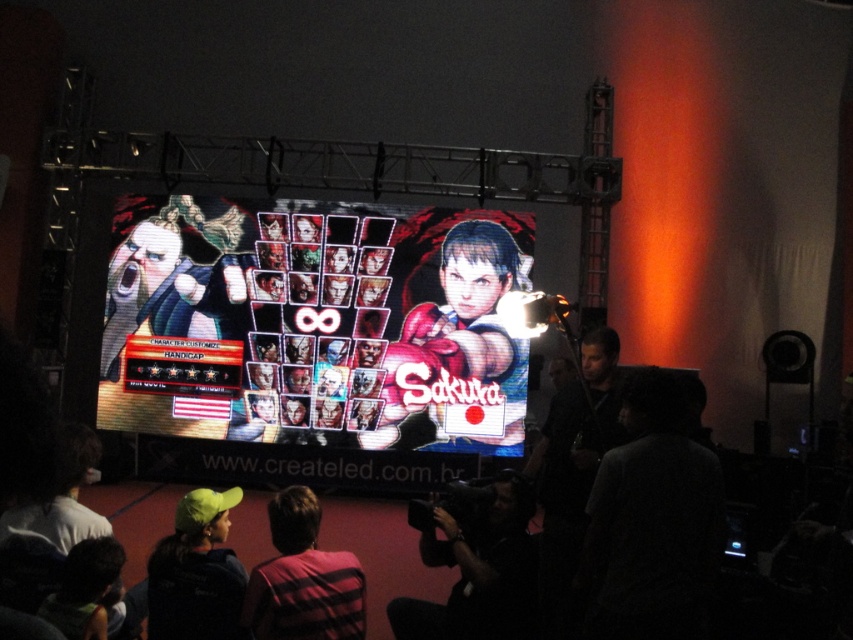
Which is above, pixelated digital display at center or plaid shirt at lower center?

pixelated digital display at center is above.

You are a GUI agent. You are given a task and a screenshot of the screen. Output one action in this format:
    pyautogui.click(x=<x>, y=<y>)
    Task: Click on the pixelated digital display at center
    This screenshot has width=853, height=640.
    Given the screenshot: What is the action you would take?
    pyautogui.click(x=314, y=323)

Image resolution: width=853 pixels, height=640 pixels. Describe the element at coordinates (314, 323) in the screenshot. I see `pixelated digital display at center` at that location.

Which is in front, point (270, 388) or point (469, 540)?

Point (469, 540) is more forward.

Where is `pixelated digital display at center`? The image size is (853, 640). pixelated digital display at center is located at coordinates (314, 323).

Who is positioned more to the right, plaid shirt at lower center or green fabric cap at lower left?

plaid shirt at lower center is more to the right.

Is plaid shirt at lower center below green fabric cap at lower left?

Actually, plaid shirt at lower center is above green fabric cap at lower left.

Measure the distance between point (x=280, y=532) and camera.

They are 4.22 meters apart.

Where is `plaid shirt at lower center`? This screenshot has height=640, width=853. plaid shirt at lower center is located at coordinates (303, 579).